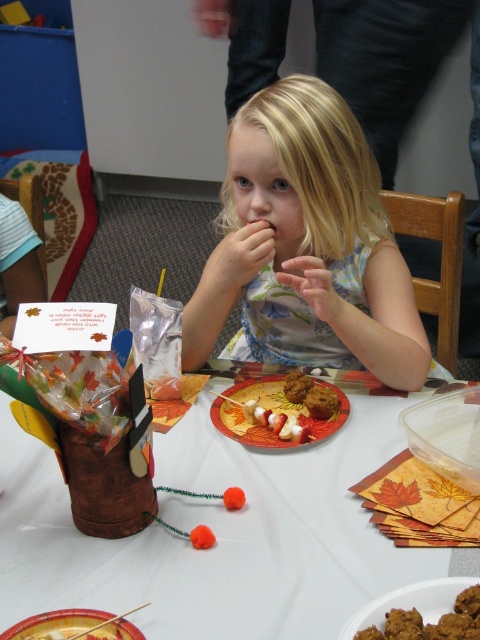
You are a photographer taking a portrait of the young girl. You notice the blonde hair at center and the brown matte cookies at center. Which object should you focus on if you want to capture the larger subject in the frame?

The blonde hair at center has a larger size compared to the brown matte cookies at center, so you should focus on the blonde hair at center to capture the larger subject in the frame.

You are taking a photo of the scene. You want to focus on the point at point (337, 426) and point (301, 269). Which point should you focus on first to ensure both are in focus?

You should focus on point (301, 269) first because it is farther from the camera than point (337, 426). By focusing on the farther point, the closer point will also be in focus due to the depth of field.